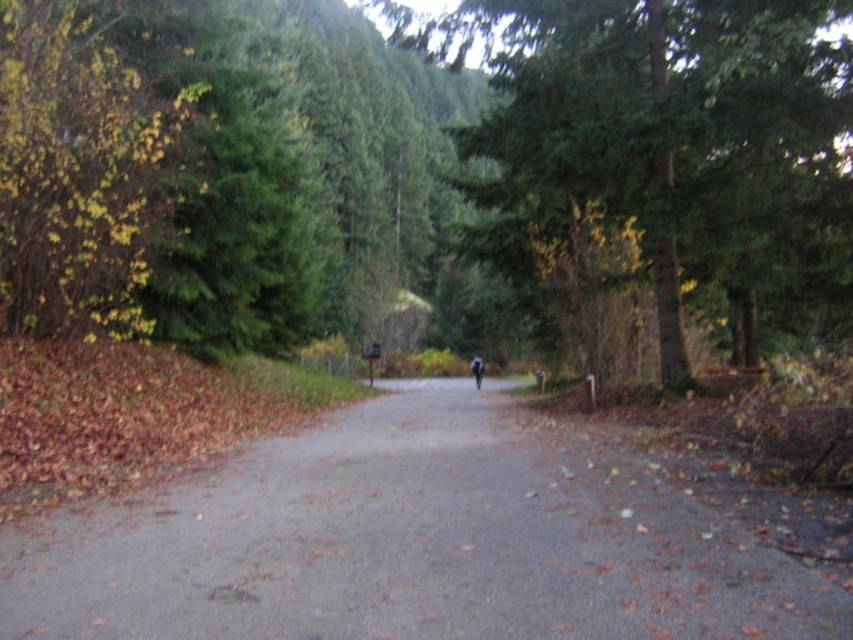
Does gray asphalt road at center appear under dark blue fabric at center?

Incorrect, gray asphalt road at center is not positioned below dark blue fabric at center.

From the picture: Is gray asphalt road at center bigger than dark blue fabric at center?

Incorrect, gray asphalt road at center is not larger than dark blue fabric at center.

Is point (809, 570) more distant than point (482, 358)?

No, it is in front of (482, 358).

Identify the location of gray asphalt road at center. [408, 544].

Consider the image. Is gray asphalt road at center positioned before green matte tree at center?

Yes, it is in front of green matte tree at center.

Which is in front, point (131, 628) or point (840, 266)?

Point (131, 628) is more forward.

Locate an element on the screen. This screenshot has width=853, height=640. gray asphalt road at center is located at coordinates (408, 544).

Is point (614, 134) farther from viewer compared to point (477, 380)?

No, it is not.

Does green matte tree at center have a lesser width compared to dark blue fabric at center?

No.

What are the coordinates of `green matte tree at center` in the screenshot? It's located at (668, 132).

Where is `green matte tree at center`? The image size is (853, 640). green matte tree at center is located at coordinates (668, 132).